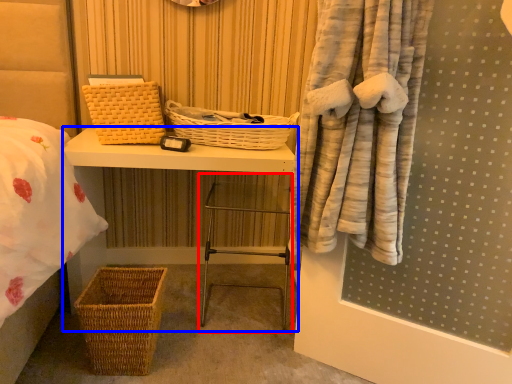
Question: Which object appears farthest to the camera in this image, step stool (highlighted by a red box) or furniture (highlighted by a blue box)?

Choices:
 (A) step stool
 (B) furniture

Answer: (A)